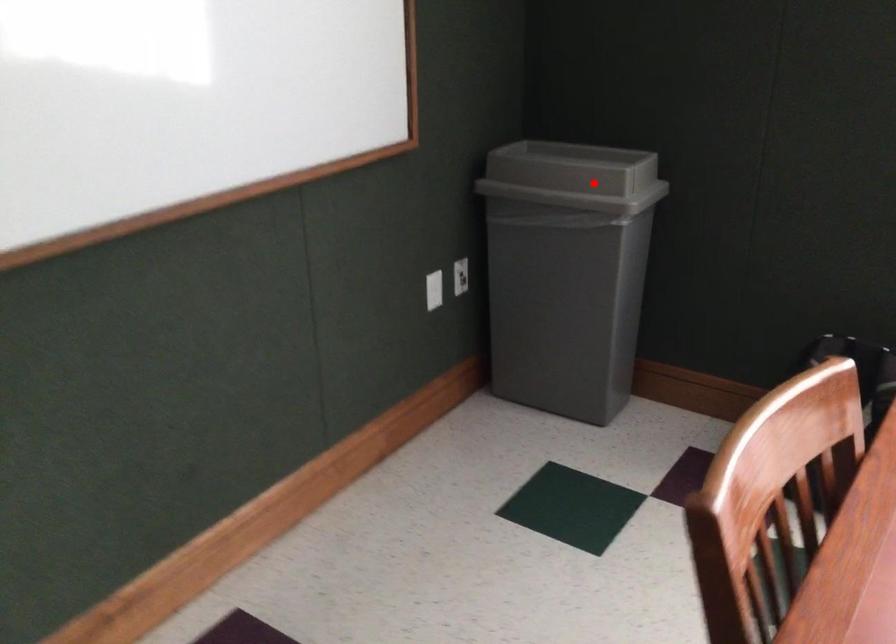
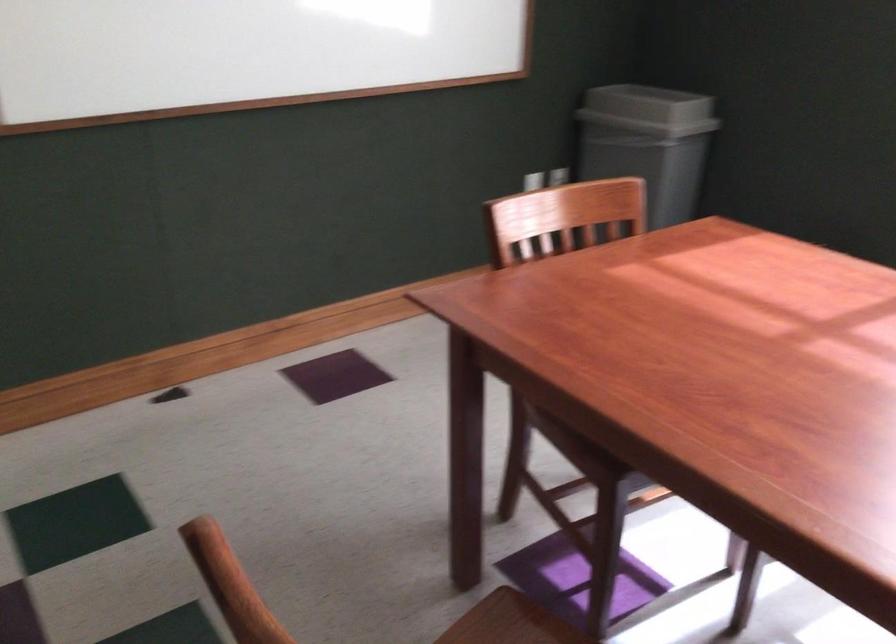
Question: A red point is marked in image1. In image2, is the corresponding 3D point closer to the camera or farther? Reply with the corresponding letter.

Choices:
 (A) The corresponding 3D point is closer.
 (B) The corresponding 3D point is farther.

Answer: (B)